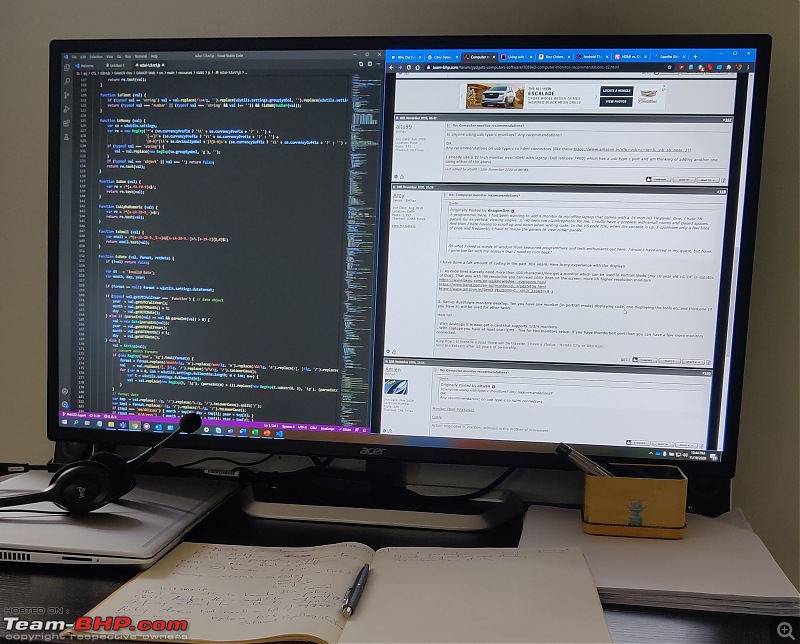
The width and height of the screenshot is (800, 644). In order to click on box in this screenshot , I will do `click(641, 491)`.